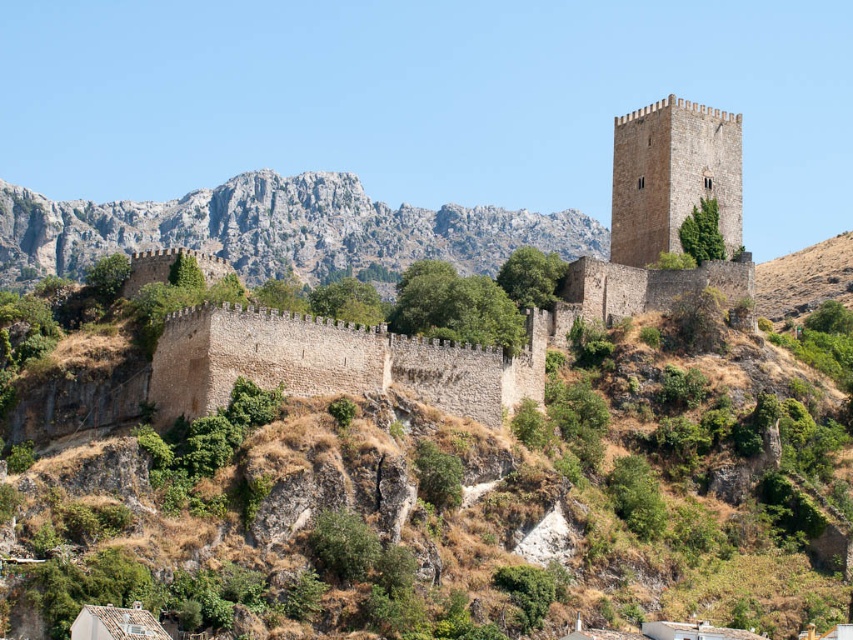
Is rugged stone mountain at upper center closer to the viewer compared to brown stone tower at upper center?

No.

Looking at this image, does rugged stone mountain at upper center appear on the left side of brown stone tower at upper center?

Correct, you'll find rugged stone mountain at upper center to the left of brown stone tower at upper center.

Find the location of a particular element. The image size is (853, 640). rugged stone mountain at upper center is located at coordinates (279, 230).